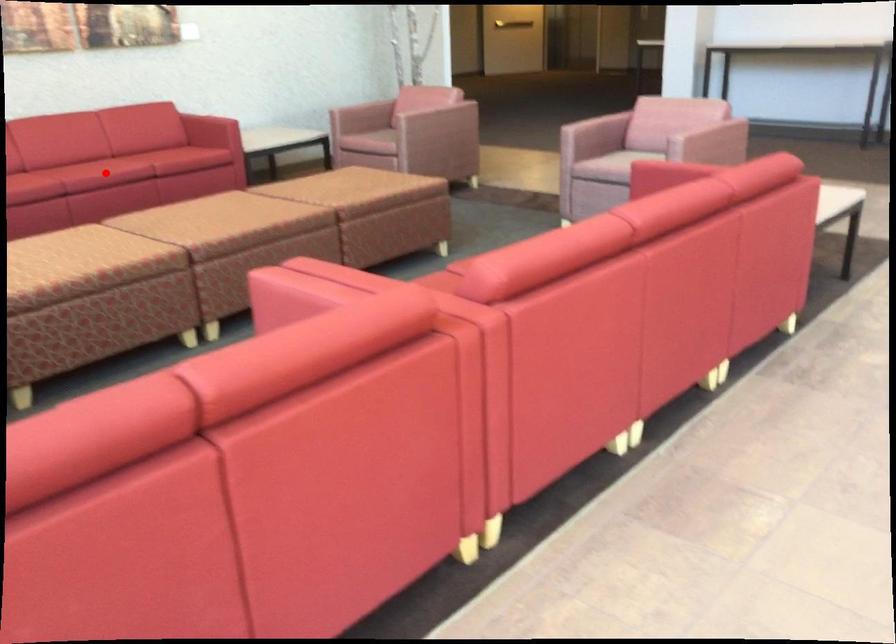
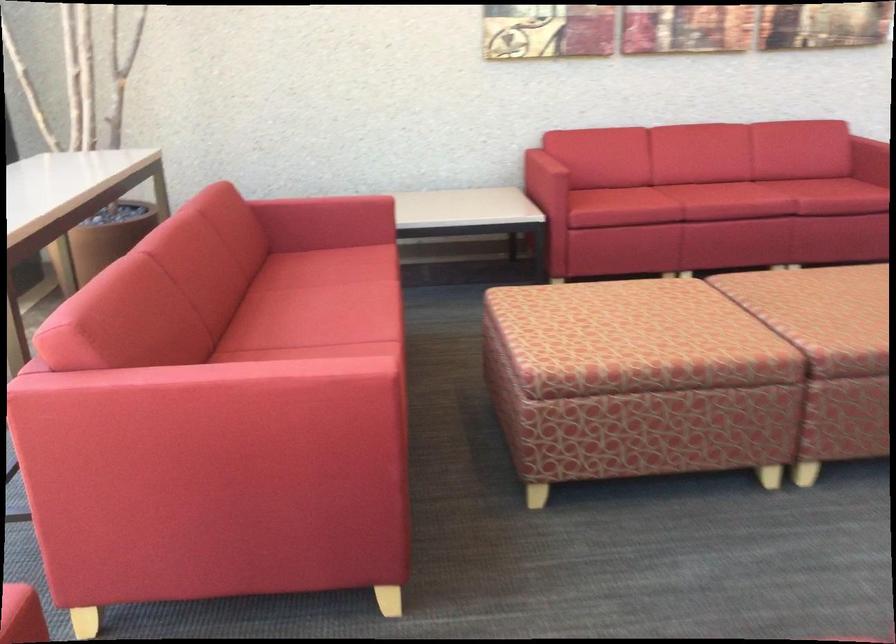
Locate, in the second image, the point that corresponds to the highlighted location in the first image.

(725, 201)